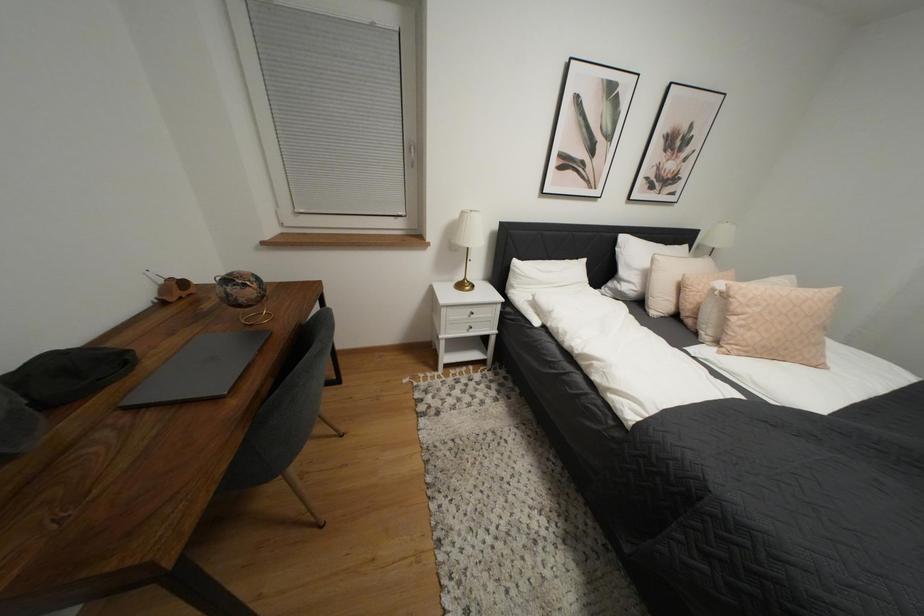
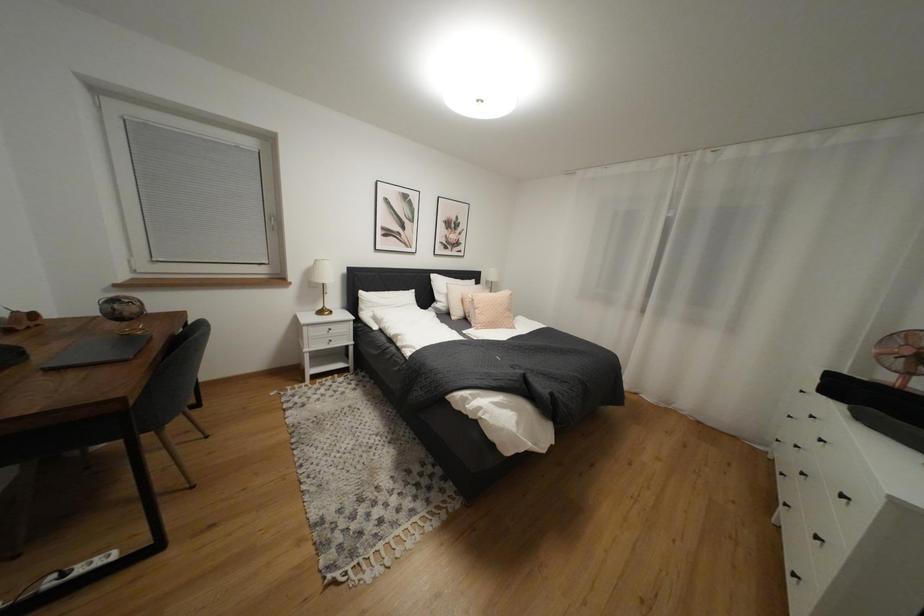
Question: What movement of the cameraman would produce the second image?

Choices:
 (A) Left
 (B) Right
 (C) Forward
 (D) Backward

Answer: (D)